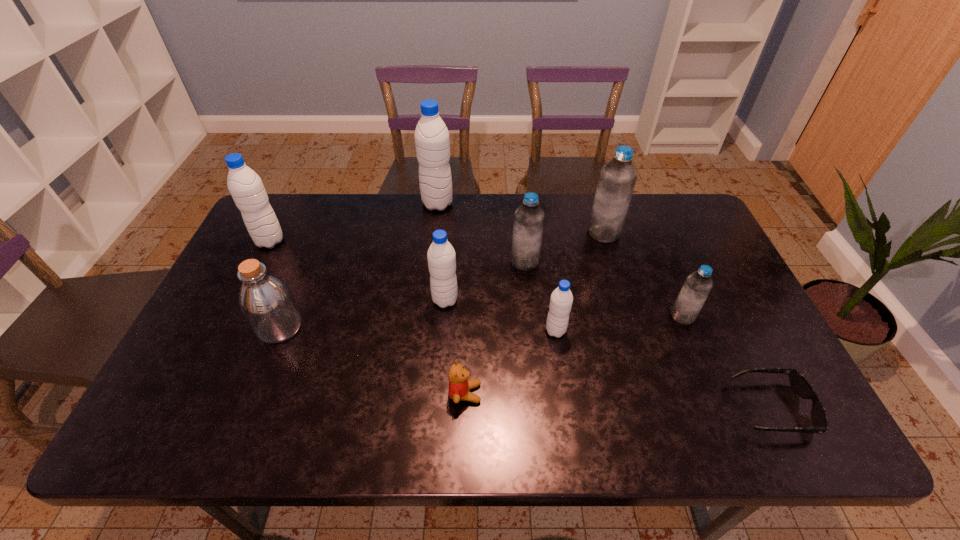
Image resolution: width=960 pixels, height=540 pixels. Identify the location of teddy bear present at the near edge. (459, 386).

Find the location of a particular element. This screenshot has width=960, height=540. sunglasses that is at the near edge is located at coordinates (801, 386).

Where is `water bottle located in the left edge section of the desktop`? The height and width of the screenshot is (540, 960). water bottle located in the left edge section of the desktop is located at coordinates (245, 186).

In order to click on bottle that is at the left edge in this screenshot , I will do [267, 303].

Where is `water bottle that is at the right edge`? water bottle that is at the right edge is located at coordinates (694, 293).

Where is `sunglasses that is at the right edge`? This screenshot has height=540, width=960. sunglasses that is at the right edge is located at coordinates (801, 386).

This screenshot has width=960, height=540. I want to click on object positioned at the far left corner, so click(x=245, y=186).

Locate an element on the screen. This screenshot has width=960, height=540. object present at the near right corner is located at coordinates (801, 386).

In order to click on free spot at the far edge of the desktop in this screenshot , I will do point(644,221).

I want to click on vacant space at the near edge of the desktop, so [641, 416].